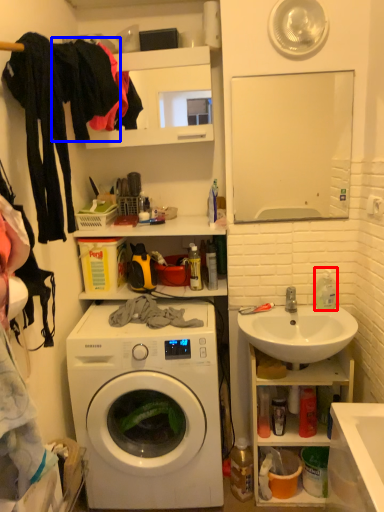
Question: Which object appears closest to the camera in this image, cleaning product (highlighted by a red box) or clothing (highlighted by a blue box)?

Choices:
 (A) cleaning product
 (B) clothing

Answer: (B)